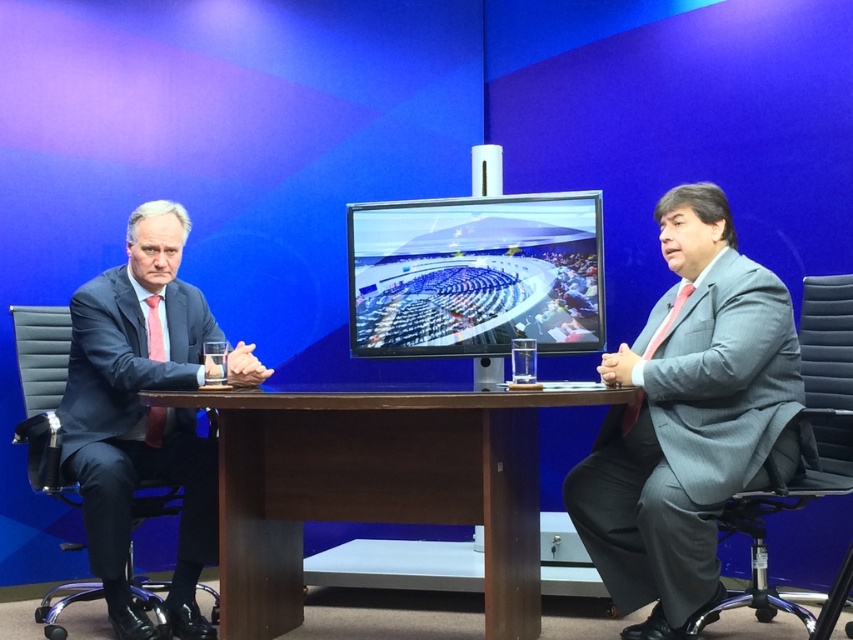
Question: Which point appears farthest from the camera in this image?

Choices:
 (A) (485, 316)
 (B) (259, 406)
 (C) (33, 435)
 (D) (695, 257)

Answer: (A)

Question: Does gray textured suit at right have a greater width compared to matte black monitor at center?

Choices:
 (A) yes
 (B) no

Answer: (B)

Question: Does gray textured suit at right appear under matte black monitor at center?

Choices:
 (A) yes
 (B) no

Answer: (A)

Question: Can you confirm if matte black monitor at center is positioned to the left of black leather swivel chair at left?

Choices:
 (A) yes
 (B) no

Answer: (B)

Question: Which of these objects is positioned closest to the gray textured suit at right?

Choices:
 (A) black leather swivel chair at left
 (B) gray fabric swivel chair at right
 (C) brown wood table at center
 (D) matte black monitor at center

Answer: (B)

Question: Which point is farther from the camera taking this photo?

Choices:
 (A) (x=709, y=577)
 (B) (x=219, y=600)
 (C) (x=543, y=310)

Answer: (C)